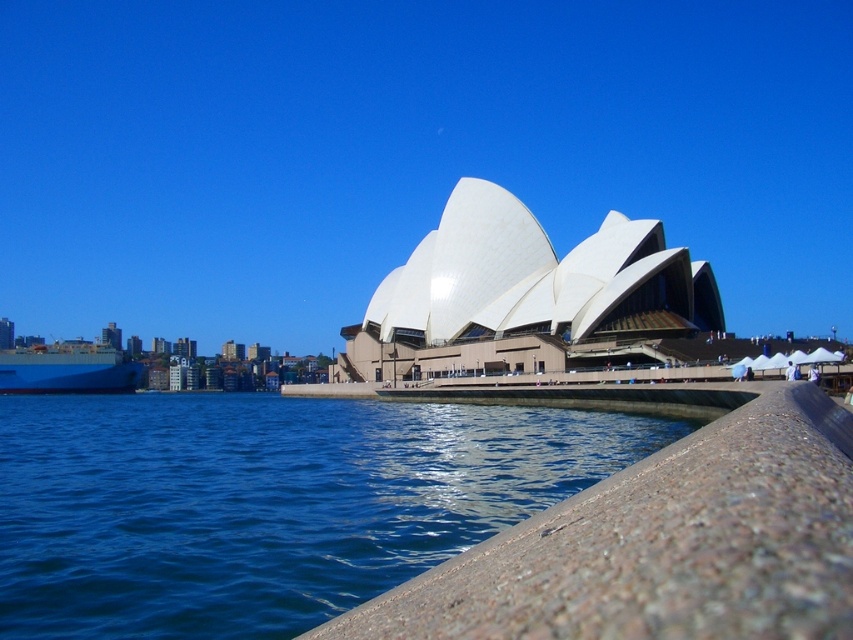
You are standing on the concrete barrier near the blue water at lower left and want to reach the blue matte ship at left. Which direction should you walk to get closer to the ship?

You should walk towards the left because the blue water at lower left is positioned under the blue matte ship at left, indicating they are aligned horizontally.

You are standing on the dock near the Sydney Opera House and want to take a photo of both the blue water at lower left and the blue matte ship at left. Which object should you focus on first to ensure both are in the frame?

You should focus on the blue water at lower left first because it is closer to the viewer than the blue matte ship at left, so adjusting the camera to include the closer object ensures the farther one will also be in the frame.